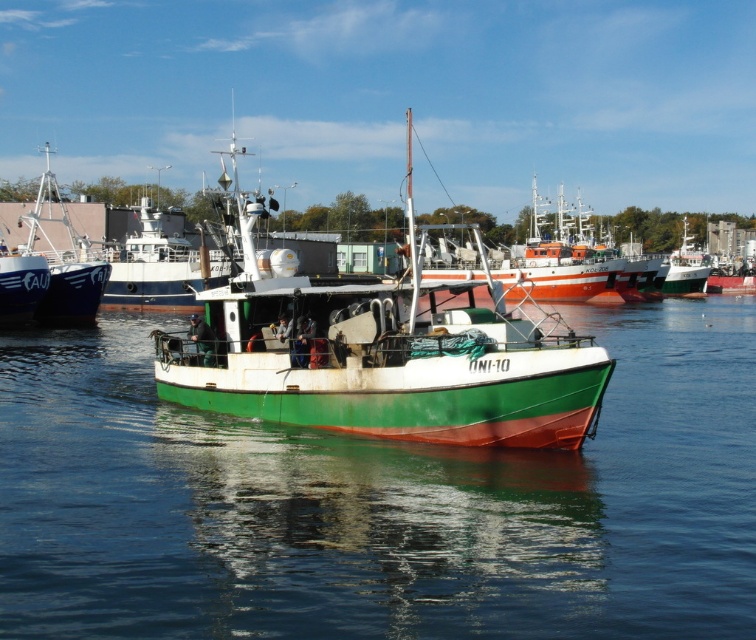
You are standing on the dock and want to board the green matte boat at center. If your walking speed is 3 feet per second, how many seconds will it take you to reach the boat?

The green matte boat at center is 90.85 feet away from the viewer. At a walking speed of 3 feet per second, it would take approximately 30.28 seconds to reach the boat.

You are a sailor planning to navigate a small boat from the green matte water at center to the white glossy boat at upper left. Given that your boat requires a minimum of 30 meters of space to maneuver safely, can you safely make this approach?

The green matte water at center is 39.30 meters from the white glossy boat at upper left. Since this distance exceeds the required 30 meters of space, you can safely navigate your boat from the green matte water at center to the white glossy boat at upper left.